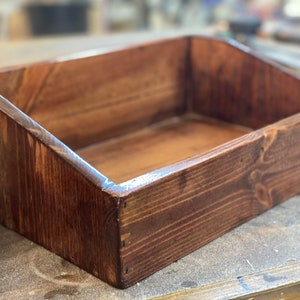
The image size is (300, 300). In order to click on right inside wall of wooden box in this screenshot , I will do `click(230, 91)`.